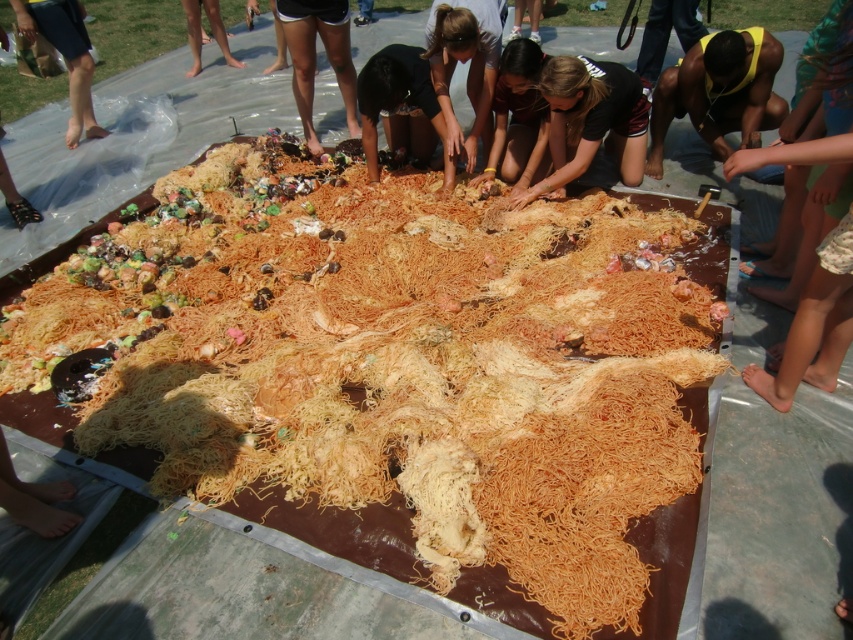
Question: Can you confirm if golden shredded noodles at center is positioned to the left of yellow skin at center?

Choices:
 (A) no
 (B) yes

Answer: (B)

Question: Which point appears closest to the camera in this image?

Choices:
 (A) (579, 168)
 (B) (628, 589)

Answer: (B)

Question: Is smooth brown hair at center further to the viewer compared to brown fabric bag at upper left?

Choices:
 (A) yes
 (B) no

Answer: (B)

Question: Does golden shredded noodles at center appear on the left side of brown fabric bag at upper left?

Choices:
 (A) yes
 (B) no

Answer: (B)

Question: Which point appears farthest from the camera in this image?

Choices:
 (A) (339, 0)
 (B) (656, 106)
 (C) (216, 32)

Answer: (C)

Question: Which object is positioned closest to the smooth brown hair at center?

Choices:
 (A) smooth tan skin at center
 (B) brown fabric bag at upper left

Answer: (A)